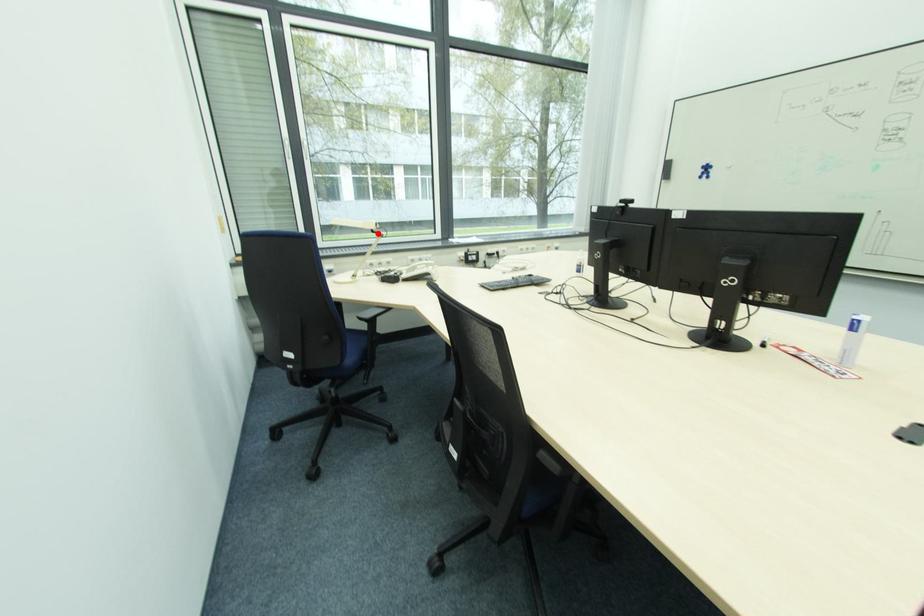
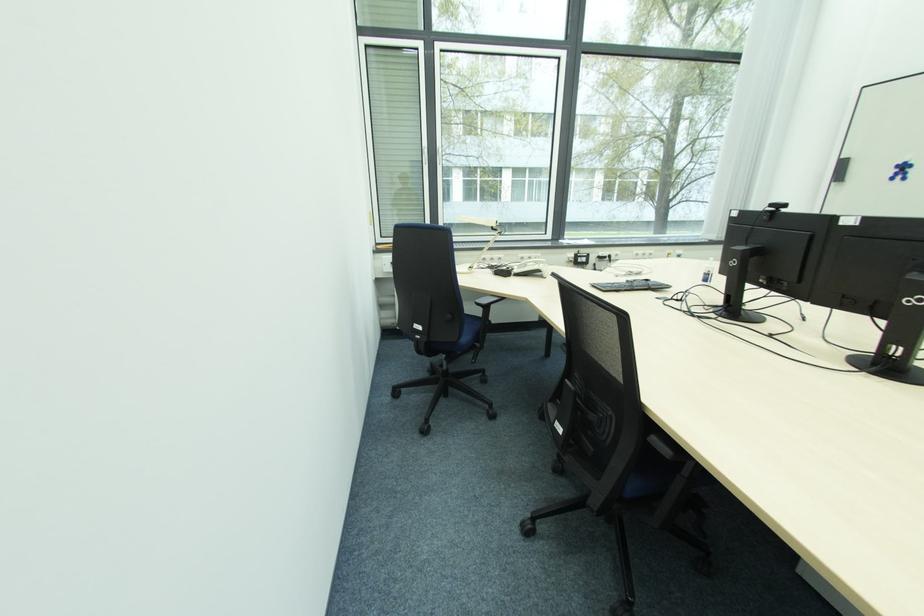
Find the pixel in the second image that matches the highlighted location in the first image.

(497, 230)